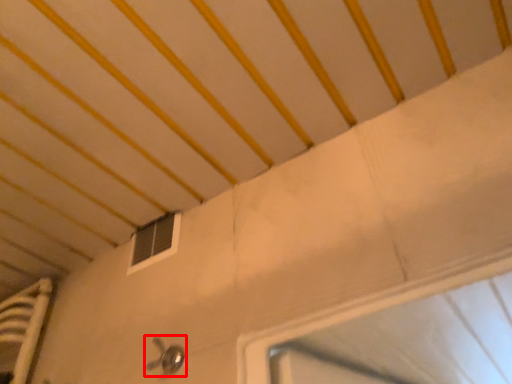
Question: In this image, where is door handle (annotated by the red box) located relative to window?

Choices:
 (A) left
 (B) right

Answer: (B)